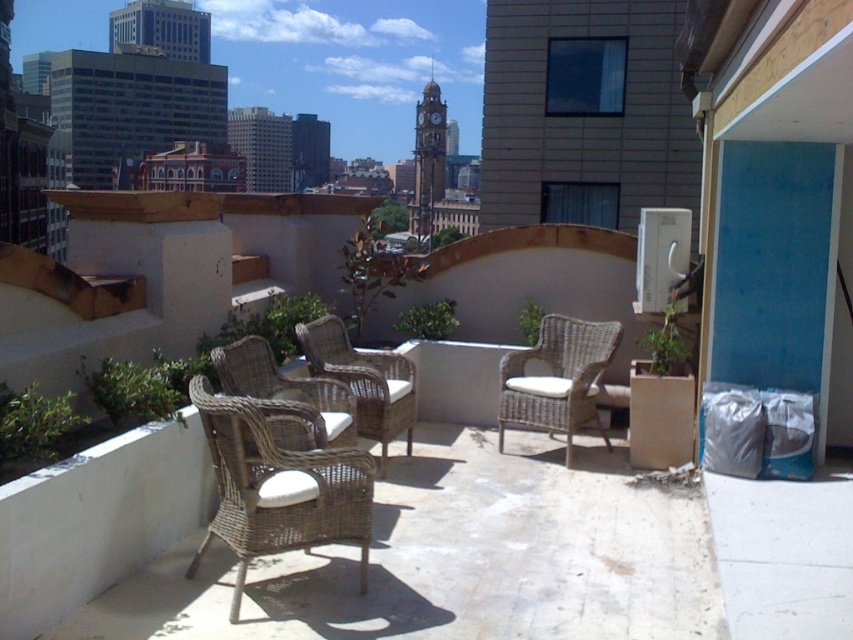
Question: Can you confirm if woven wicker armchair at center is positioned above woven wicker chair at center?

Choices:
 (A) yes
 (B) no

Answer: (B)

Question: Considering the relative positions of woven wicker armchair at center and woven wicker chair at center in the image provided, where is woven wicker armchair at center located with respect to woven wicker chair at center?

Choices:
 (A) right
 (B) left

Answer: (B)

Question: Is woven wicker armchair at center thinner than woven rattan armchair at center?

Choices:
 (A) yes
 (B) no

Answer: (B)

Question: Which point is closer to the camera taking this photo?

Choices:
 (A) (268, 364)
 (B) (349, 516)
 (C) (315, 320)
 (D) (498, 422)

Answer: (B)

Question: Which object is closer to the camera taking this photo?

Choices:
 (A) woven rattan chair at center
 (B) woven wicker chair at center

Answer: (B)

Question: Which object appears farthest from the camera in this image?

Choices:
 (A) woven wicker chair at center
 (B) woven wicker armchair at center
 (C) woven rattan chair at center

Answer: (C)